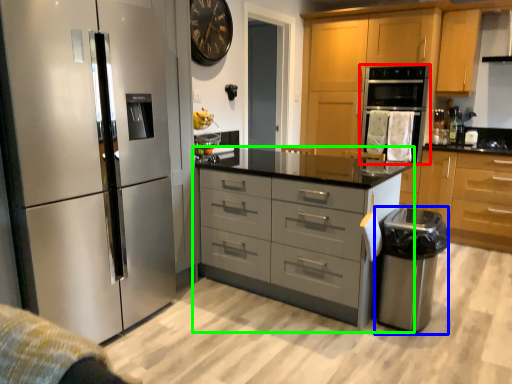
Question: Which object is positioned closest to oven (highlighted by a red box)? Select from appliance (highlighted by a blue box) and chest of drawers (highlighted by a green box).

Choices:
 (A) appliance
 (B) chest of drawers

Answer: (A)